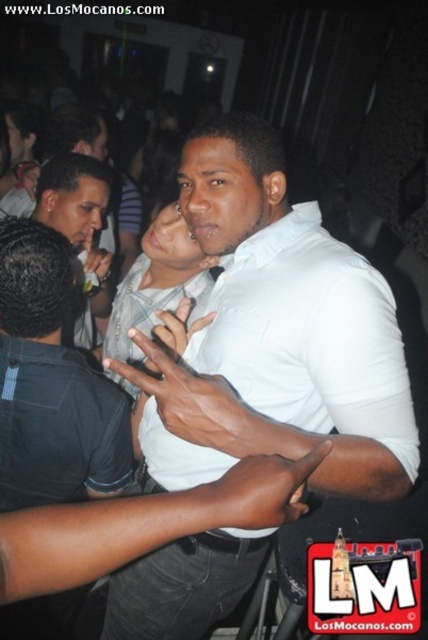
Question: From the image, what is the correct spatial relationship of white matte shirt at center in relation to matte white shirt at center?

Choices:
 (A) right
 (B) left

Answer: (A)

Question: Does white matte shirt at center come in front of matte white shirt at center?

Choices:
 (A) yes
 (B) no

Answer: (A)

Question: Which object appears closest to the camera in this image?

Choices:
 (A) white matte shirt at center
 (B) matte white shirt at center

Answer: (A)

Question: Is white matte shirt at center wider than matte white shirt at center?

Choices:
 (A) no
 (B) yes

Answer: (B)

Question: Which point is farther to the camera?

Choices:
 (A) (175, 621)
 (B) (158, 268)

Answer: (B)